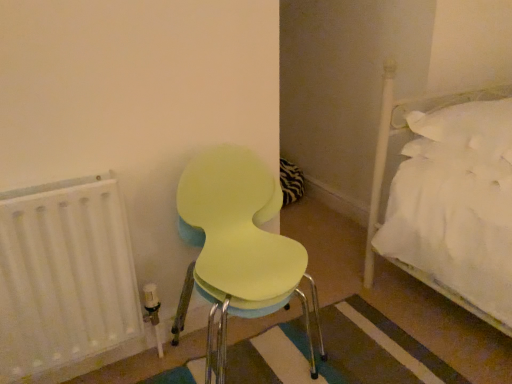
Question: From the image's perspective, is white matte radiator at left on light yellow plastic chair at center-left?

Choices:
 (A) no
 (B) yes

Answer: (A)

Question: Does white matte radiator at left lie in front of light yellow plastic chair at center-left?

Choices:
 (A) yes
 (B) no

Answer: (B)

Question: From a real-world perspective, is white matte radiator at left positioned under light yellow plastic chair at center-left based on gravity?

Choices:
 (A) yes
 (B) no

Answer: (A)

Question: Is white matte radiator at left positioned with its back to light yellow plastic chair at center-left?

Choices:
 (A) no
 (B) yes

Answer: (A)

Question: Are white matte radiator at left and light yellow plastic chair at center-left beside each other?

Choices:
 (A) yes
 (B) no

Answer: (B)

Question: Does white matte radiator at left have a greater height compared to light yellow plastic chair at center-left?

Choices:
 (A) no
 (B) yes

Answer: (A)

Question: From the image's perspective, is light yellow plastic chair at center-left under white matte radiator at left?

Choices:
 (A) yes
 (B) no

Answer: (B)

Question: Is light yellow plastic chair at center-left wider than white matte radiator at left?

Choices:
 (A) yes
 (B) no

Answer: (A)

Question: From the image's perspective, is light yellow plastic chair at center-left on white matte radiator at left?

Choices:
 (A) no
 (B) yes

Answer: (B)

Question: Considering the relative sizes of light yellow plastic chair at center-left and white matte radiator at left in the image provided, is light yellow plastic chair at center-left smaller than white matte radiator at left?

Choices:
 (A) yes
 (B) no

Answer: (B)

Question: Is light yellow plastic chair at center-left positioned beyond the bounds of white matte radiator at left?

Choices:
 (A) no
 (B) yes

Answer: (B)

Question: Is light yellow plastic chair at center-left oriented towards white matte radiator at left?

Choices:
 (A) yes
 (B) no

Answer: (B)

Question: Would you say light yellow plastic chair at center-left is inside or outside white matte radiator at left?

Choices:
 (A) inside
 (B) outside

Answer: (B)